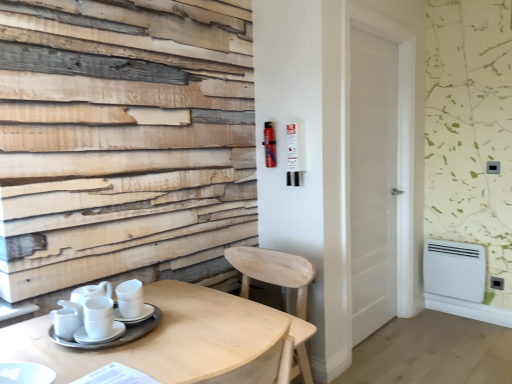
Question: Could you tell me if white wooden door at center is facing white plastic radiator at lower right?

Choices:
 (A) yes
 (B) no

Answer: (B)

Question: Is white wooden door at center far away from white plastic radiator at lower right?

Choices:
 (A) no
 (B) yes

Answer: (A)

Question: Considering the relative sizes of white wooden door at center and white plastic radiator at lower right in the image provided, is white wooden door at center shorter than white plastic radiator at lower right?

Choices:
 (A) no
 (B) yes

Answer: (A)

Question: Can you confirm if white wooden door at center is wider than white plastic radiator at lower right?

Choices:
 (A) no
 (B) yes

Answer: (A)

Question: Is white wooden door at center positioned with its back to white plastic radiator at lower right?

Choices:
 (A) yes
 (B) no

Answer: (B)

Question: Is white wooden door at center in front of white plastic radiator at lower right?

Choices:
 (A) yes
 (B) no

Answer: (A)

Question: Is light wood chair at lower center not near light wood table at lower left?

Choices:
 (A) no
 (B) yes

Answer: (A)

Question: Is the depth of light wood chair at lower center less than that of light wood table at lower left?

Choices:
 (A) no
 (B) yes

Answer: (A)

Question: Does light wood chair at lower center have a larger size compared to light wood table at lower left?

Choices:
 (A) yes
 (B) no

Answer: (B)

Question: Is light wood chair at lower center aimed at light wood table at lower left?

Choices:
 (A) yes
 (B) no

Answer: (A)

Question: Is light wood chair at lower center outside light wood table at lower left?

Choices:
 (A) yes
 (B) no

Answer: (A)

Question: Considering the relative sizes of light wood chair at lower center and light wood table at lower left in the image provided, is light wood chair at lower center taller than light wood table at lower left?

Choices:
 (A) no
 (B) yes

Answer: (B)

Question: From a real-world perspective, is white glossy cups at lower left physically above white glossy cup at center?

Choices:
 (A) yes
 (B) no

Answer: (B)